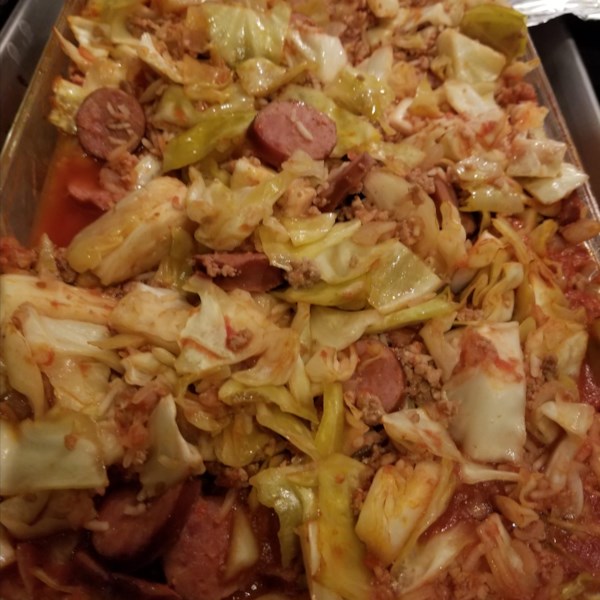
This screenshot has width=600, height=600. Find the location of `baking dish`. baking dish is located at coordinates (31, 131).